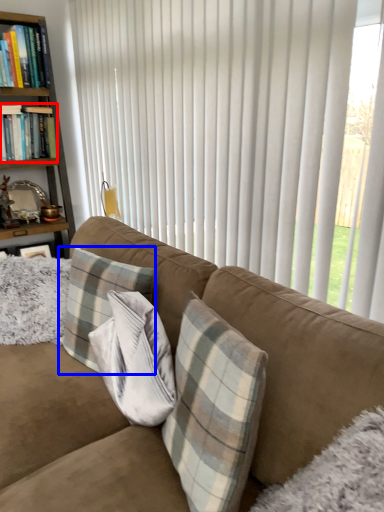
Question: Which of the following is the farthest to the observer, book (highlighted by a red box) or pillow (highlighted by a blue box)?

Choices:
 (A) book
 (B) pillow

Answer: (A)